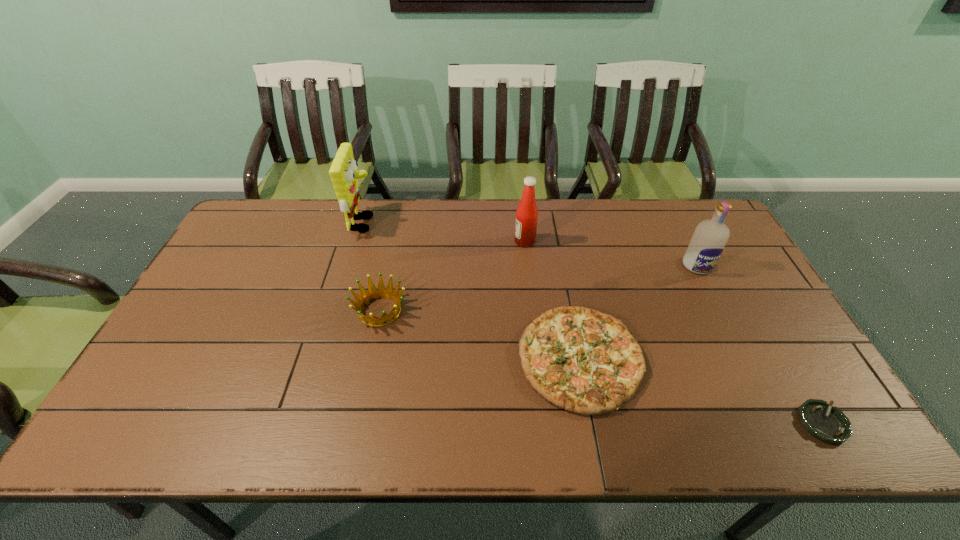
Where is `vodka at the right edge`? vodka at the right edge is located at coordinates (707, 244).

The width and height of the screenshot is (960, 540). Find the location of `ashtray located at the right edge`. ashtray located at the right edge is located at coordinates (829, 424).

In order to click on object that is positioned at the near right corner in this screenshot , I will do `click(829, 424)`.

Image resolution: width=960 pixels, height=540 pixels. What are the coordinates of `vacant region at the far edge of the desktop` in the screenshot? It's located at (305, 208).

You are a GUI agent. You are given a task and a screenshot of the screen. Output one action in this format:
    pyautogui.click(x=<x>, y=<y>)
    Task: Click on the free region at the near edge
    
    Given the screenshot: What is the action you would take?
    pyautogui.click(x=204, y=443)

Where is `vacant space at the left edge`? vacant space at the left edge is located at coordinates (226, 326).

This screenshot has height=540, width=960. Identify the location of free space at the right edge. (790, 373).

In the image, there is a desktop. Where is `vacant space at the near right corner`? This screenshot has height=540, width=960. vacant space at the near right corner is located at coordinates (782, 413).

Find the location of a particular element. The image size is (960, 540). empty space that is in between the fifth object from left to right and the crown is located at coordinates (539, 288).

Locate an element on the screen. free space between the sponge and the crown is located at coordinates (372, 267).